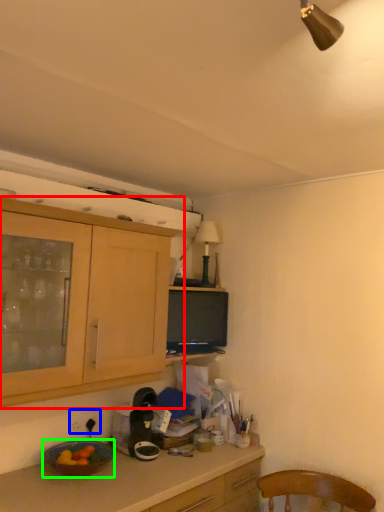
Question: Based on their relative distances, which object is farther from cabinetry (highlighted by a red box)? Choose from power outlet (highlighted by a blue box) and bowl (highlighted by a green box).

Choices:
 (A) power outlet
 (B) bowl

Answer: (A)